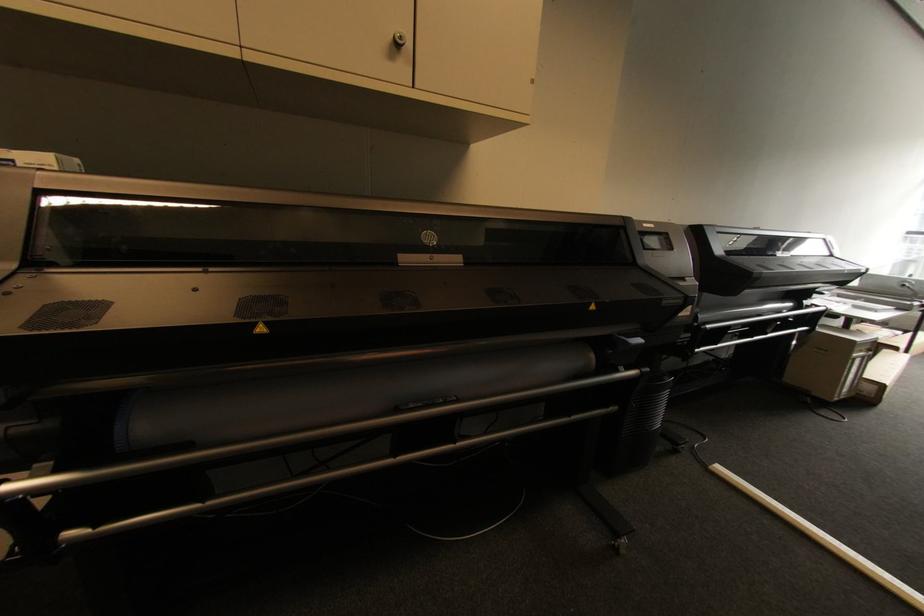
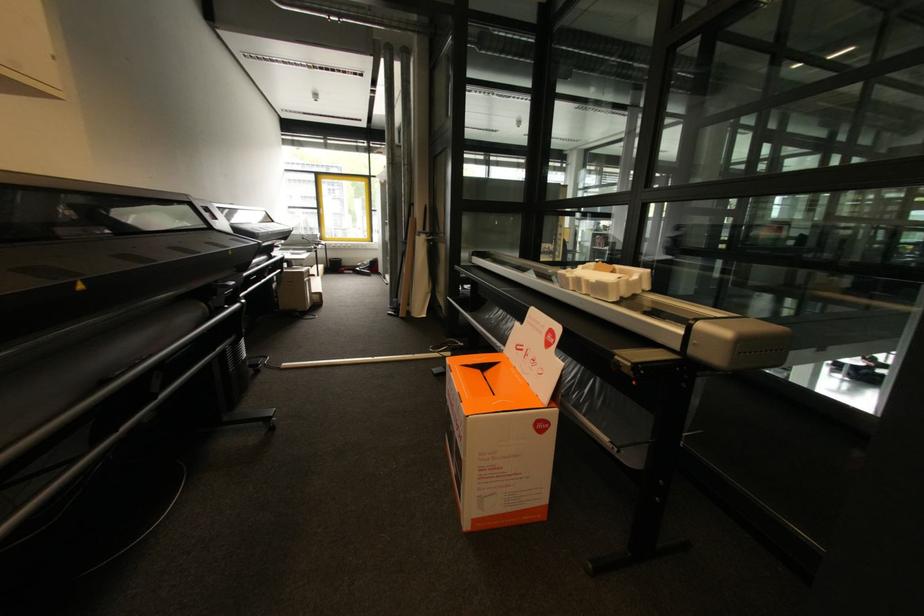
The images are taken continuously from a first-person perspective. In which direction is your viewpoint rotating?

The camera rotated toward right-down.